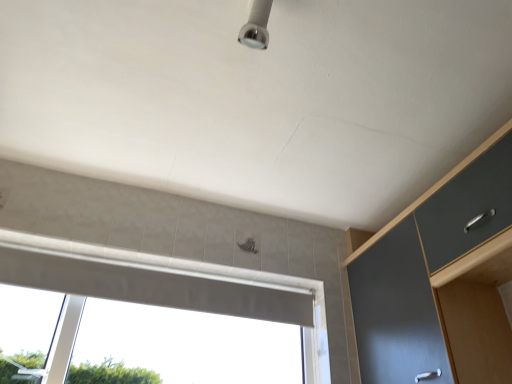
The height and width of the screenshot is (384, 512). What do you see at coordinates (440, 279) in the screenshot?
I see `matte gray cabinet at right` at bounding box center [440, 279].

Identify the location of matte gray cabinet at right. The width and height of the screenshot is (512, 384). point(440,279).

Find the location of a particular element. The height and width of the screenshot is (384, 512). white glossy window at center is located at coordinates (170, 291).

In order to face white glossy window at center, should I rotate leftwards or rightwards?

A 13.252 degree turn to the left will do.

Image resolution: width=512 pixels, height=384 pixels. What do you see at coordinates (170, 291) in the screenshot?
I see `white glossy window at center` at bounding box center [170, 291].

Where is `matte gray cabinet at right`? matte gray cabinet at right is located at coordinates (440, 279).

Is matte gray cabinet at right at the left side of white glossy window at center?

Incorrect, matte gray cabinet at right is not on the left side of white glossy window at center.

In the image, is matte gray cabinet at right positioned in front of or behind white glossy window at center?

matte gray cabinet at right is in front of white glossy window at center.

Is point (494, 367) farther from viewer compared to point (139, 278)?

No.

From the image's perspective, is matte gray cabinet at right under white glossy window at center?

No.

From a real-world perspective, is matte gray cabinet at right physically located above or below white glossy window at center?

matte gray cabinet at right is situated higher than white glossy window at center in the real world.

In terms of width, does matte gray cabinet at right look wider or thinner when compared to white glossy window at center?

matte gray cabinet at right is wider than white glossy window at center.

Considering the sizes of objects matte gray cabinet at right and white glossy window at center in the image provided, who is shorter, matte gray cabinet at right or white glossy window at center?

With less height is white glossy window at center.

Between matte gray cabinet at right and white glossy window at center, which one has smaller size?

With smaller size is white glossy window at center.

Is matte gray cabinet at right not within white glossy window at center?

Yes, matte gray cabinet at right is not within white glossy window at center.

Is matte gray cabinet at right positioned far away from white glossy window at center?

matte gray cabinet at right is near white glossy window at center, not far away.

Is matte gray cabinet at right aimed at white glossy window at center?

Yes, matte gray cabinet at right is facing white glossy window at center.

Based on the photo, what's the angular difference between matte gray cabinet at right and white glossy window at center's facing directions?

89.8 degrees.

Measure the distance between matte gray cabinet at right and white glossy window at center.

A distance of 25.99 inches exists between matte gray cabinet at right and white glossy window at center.

This screenshot has height=384, width=512. Find the location of `dresser on the right side of white glossy window at center`. dresser on the right side of white glossy window at center is located at coordinates (440, 279).

Considering the relative positions of white glossy window at center and matte gray cabinet at right in the image provided, is white glossy window at center to the right of matte gray cabinet at right from the viewer's perspective?

In fact, white glossy window at center is to the left of matte gray cabinet at right.

Does white glossy window at center come behind matte gray cabinet at right?

Yes, the depth of white glossy window at center is greater than that of matte gray cabinet at right.

Does point (106, 282) lie in front of point (441, 212)?

No, (106, 282) is behind (441, 212).

From the image's perspective, who appears lower, white glossy window at center or matte gray cabinet at right?

white glossy window at center.

From a real-world perspective, which is physically below, white glossy window at center or matte gray cabinet at right?

In real-world perspective, white glossy window at center is lower.

Looking at their sizes, would you say white glossy window at center is wider or thinner than matte gray cabinet at right?

In the image, white glossy window at center appears to be more narrow than matte gray cabinet at right.

Is white glossy window at center taller than matte gray cabinet at right?

No.

Considering the sizes of objects white glossy window at center and matte gray cabinet at right in the image provided, who is smaller, white glossy window at center or matte gray cabinet at right?

white glossy window at center is smaller.

Would you say matte gray cabinet at right is part of white glossy window at center's contents?

No.

Is white glossy window at center next to matte gray cabinet at right and touching it?

There is a gap between white glossy window at center and matte gray cabinet at right.

Could you tell me if white glossy window at center is facing matte gray cabinet at right?

Yes, white glossy window at center is turned towards matte gray cabinet at right.

How many degrees apart are the facing directions of white glossy window at center and matte gray cabinet at right?

white glossy window at center and matte gray cabinet at right are facing 89.8 degrees away from each other.

Where is `window located underneath the matte gray cabinet at right (from a real-world perspective)`? Image resolution: width=512 pixels, height=384 pixels. window located underneath the matte gray cabinet at right (from a real-world perspective) is located at coordinates (170, 291).

Where is `dresser on the right of white glossy window at center`? The image size is (512, 384). dresser on the right of white glossy window at center is located at coordinates (440, 279).

Find the location of a particular element. The image size is (512, 384). window below the matte gray cabinet at right (from the image's perspective) is located at coordinates (170, 291).